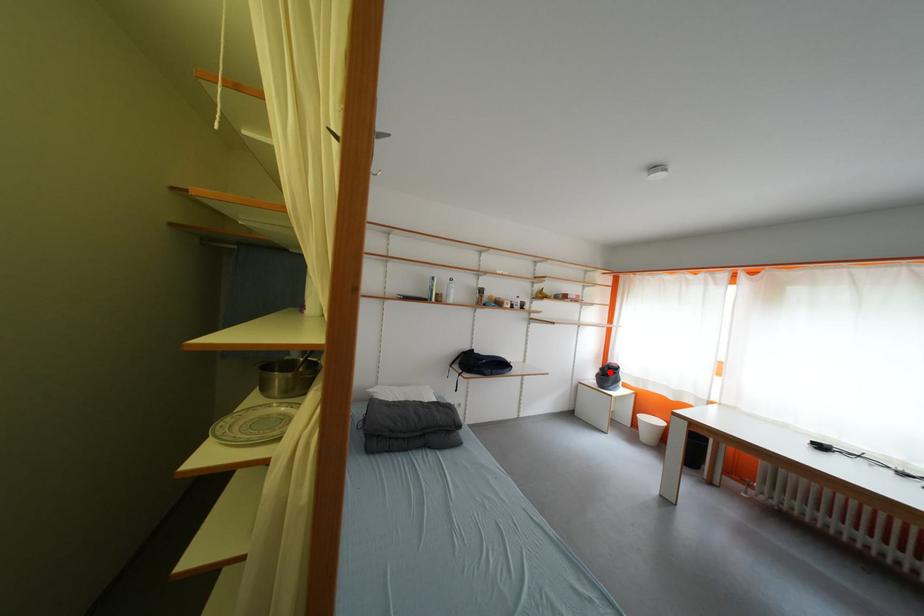
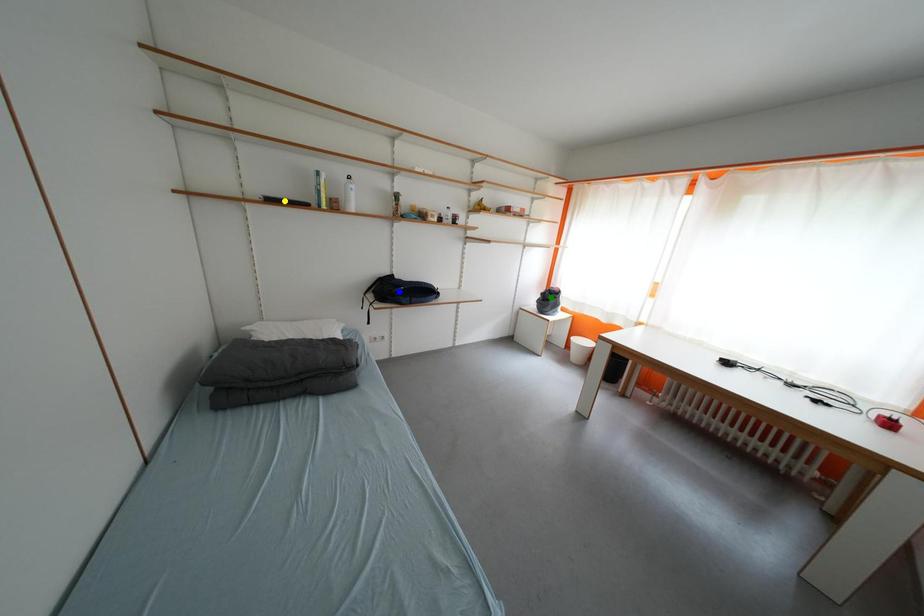
Question: I am providing you with two images of the same scene from different viewpoints. A red point is marked on the first image. You are given multiple points on the second image. Which spot in image 2 lines up with the point in image 1?

Choices:
 (A) yellow point
 (B) blue point
 (C) green point

Answer: (C)